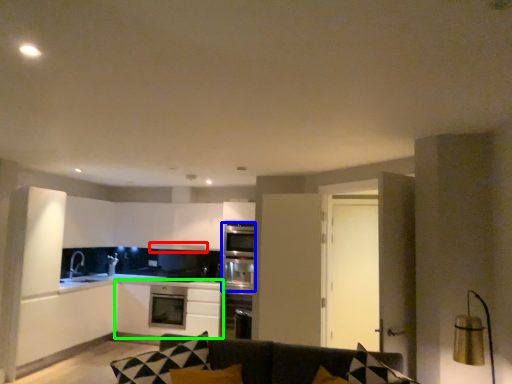
Question: Considering the real-world distances, which object is closest to exhaust hood (highlighted by a red box)? oven (highlighted by a blue box) or cabinetry (highlighted by a green box).

Choices:
 (A) oven
 (B) cabinetry

Answer: (A)